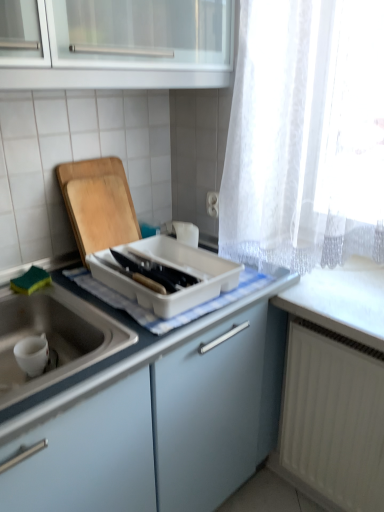
The height and width of the screenshot is (512, 384). I want to click on wooden cutting board at left, so click(98, 204).

Measure the distance between point (x=89, y=160) and camera.

The distance of point (x=89, y=160) from camera is 4.46 feet.

Where is `white plastic tray at center`? white plastic tray at center is located at coordinates (174, 271).

Identify the location of white matte sink at lower left. The image size is (384, 512). (87, 455).

Does white matte sink at lower left have a lesser width compared to white matte radiator at lower right?

No, white matte sink at lower left is not thinner than white matte radiator at lower right.

Is point (142, 444) farther from camera compared to point (328, 477)?

No, it is not.

From a real-world perspective, is white matte sink at lower left over white matte radiator at lower right?

Yes, from a real-world perspective, white matte sink at lower left is on top of white matte radiator at lower right.

Find the location of a particular element. This screenshot has height=512, width=384. radiator on the right of white matte sink at lower left is located at coordinates (334, 417).

From the image's perspective, which is below, white matte radiator at lower right or white plastic tray at center?

white matte radiator at lower right.

Can you confirm if white matte radiator at lower right is bigger than white plastic tray at center?

Yes, white matte radiator at lower right is bigger than white plastic tray at center.

In the image, there is a white plastic tray at center. At what (x,y) coordinates should I click in order to perform the action: click on radiator below it (from the image's perspective). Please return your answer as a coordinate pair (x, y). The width and height of the screenshot is (384, 512). Looking at the image, I should click on (334, 417).

Considering the positions of point (122, 276) and point (90, 208), is point (122, 276) closer or farther from the camera than point (90, 208)?

Point (122, 276).

Between white plastic tray at center and wooden cutting board at left, which one has smaller size?

With smaller size is wooden cutting board at left.

Could you tell me if white plastic tray at center is facing wooden cutting board at left?

No, white plastic tray at center is not turned towards wooden cutting board at left.

Who is shorter, white plastic tray at center or wooden cutting board at left?

white plastic tray at center.

Looking at this image, are white plastic tray at center and white matte radiator at lower right making contact?

They are not placed beside each other.

From a real-world perspective, which is physically below, white plastic tray at center or white matte radiator at lower right?

white matte radiator at lower right is physically lower.

Considering the positions of objects white plastic tray at center and white matte radiator at lower right in the image provided, who is more to the left, white plastic tray at center or white matte radiator at lower right?

Positioned to the left is white plastic tray at center.

Is white matte radiator at lower right placed right next to wooden cutting board at left?

white matte radiator at lower right and wooden cutting board at left are not in contact.

Is white matte radiator at lower right situated inside wooden cutting board at left or outside?

white matte radiator at lower right is outside wooden cutting board at left.

What are the coordinates of `cutting board located behind the white matte radiator at lower right` in the screenshot? It's located at (98, 204).

Does point (93, 419) come closer to viewer compared to point (98, 218)?

Yes, point (93, 419) is in front of point (98, 218).

Is the position of white matte sink at lower left less distant than that of wooden cutting board at left?

Yes, it is in front of wooden cutting board at left.

From the image's perspective, is white matte sink at lower left positioned above or below wooden cutting board at left?

Clearly, from the image's perspective, white matte sink at lower left is below wooden cutting board at left.

Does white matte sink at lower left have a greater width compared to wooden cutting board at left?

Result: Yes, white matte sink at lower left is wider than wooden cutting board at left.

Is white matte sink at lower left surrounded by white matte radiator at lower right?

No, white matte radiator at lower right does not contain white matte sink at lower left.

Can you confirm if white matte radiator at lower right is shorter than white matte sink at lower left?

Incorrect, the height of white matte radiator at lower right does not fall short of that of white matte sink at lower left.

Considering the relative positions of white matte radiator at lower right and white matte sink at lower left in the image provided, is white matte radiator at lower right behind white matte sink at lower left?

Yes.

Considering the relative sizes of white matte radiator at lower right and white matte sink at lower left in the image provided, is white matte radiator at lower right thinner than white matte sink at lower left?

Yes, white matte radiator at lower right is thinner than white matte sink at lower left.

This screenshot has height=512, width=384. I want to click on cabinetry above the white matte radiator at lower right (from the image's perspective), so pyautogui.click(x=87, y=455).

Where is `radiator that is below the white plastic tray at center (from the image's perspective)`? The image size is (384, 512). radiator that is below the white plastic tray at center (from the image's perspective) is located at coordinates (334, 417).

From the image, which object appears to be farther from white plastic tray at center, white matte sink at lower left or wooden cutting board at left?

Among the two, white matte sink at lower left is located further to white plastic tray at center.

Estimate the real-world distances between objects in this image. Which object is closer to white plastic tray at center, white matte radiator at lower right or white matte sink at lower left?

white matte sink at lower left.

Which object lies further to the anchor point white matte radiator at lower right, wooden cutting board at left or white plastic tray at center?

Among the two, wooden cutting board at left is located further to white matte radiator at lower right.

Considering their positions, is white matte sink at lower left positioned closer to wooden cutting board at left than white plastic tray at center?

white plastic tray at center is closer to wooden cutting board at left.

Estimate the real-world distances between objects in this image. Which object is further from white matte radiator at lower right, white matte sink at lower left or wooden cutting board at left?

The object further to white matte radiator at lower right is wooden cutting board at left.

Estimate the real-world distances between objects in this image. Which object is closer to wooden cutting board at left, white plastic tray at center or white matte radiator at lower right?

white plastic tray at center is positioned closer to the anchor wooden cutting board at left.

Estimate the real-world distances between objects in this image. Which object is closer to white plastic tray at center, wooden cutting board at left or white matte radiator at lower right?

wooden cutting board at left.

From the image, which object appears to be farther from white matte radiator at lower right, white plastic tray at center or wooden cutting board at left?

wooden cutting board at left lies further to white matte radiator at lower right than the other object.

Locate an element on the screen. The width and height of the screenshot is (384, 512). kitchen appliance situated between white matte sink at lower left and white matte radiator at lower right from left to right is located at coordinates (174, 271).

Where is `kitchen appliance between white matte sink at lower left and wooden cutting board at left in the front-back direction`? The image size is (384, 512). kitchen appliance between white matte sink at lower left and wooden cutting board at left in the front-back direction is located at coordinates (174, 271).

Locate an element on the screen. kitchen appliance located between wooden cutting board at left and white matte radiator at lower right in the left-right direction is located at coordinates (174, 271).

In order to click on cutting board between white matte sink at lower left and white matte radiator at lower right in the horizontal direction in this screenshot , I will do (98, 204).